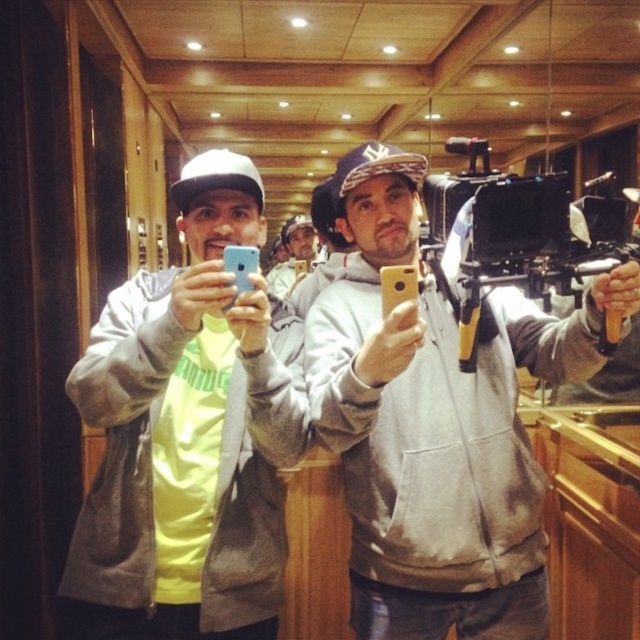
Question: Among these points, which one is farthest from the camera?

Choices:
 (A) (500, 380)
 (B) (579, 300)
 (C) (211, 161)

Answer: (A)

Question: Which point appears closest to the camera in this image?

Choices:
 (A) (272, 272)
 (B) (492, 417)
 (C) (68, 397)

Answer: (B)

Question: Estimate the real-world distances between objects in this image. Which object is closer to the matte yellow shirt at center?

Choices:
 (A) matte yellow phone at center
 (B) black plastic video camera at center right
 (C) gray matte hoodie at center

Answer: (C)

Question: Is gray matte hoodie at center thinner than matte yellow shirt at center?

Choices:
 (A) no
 (B) yes

Answer: (A)

Question: Does gray matte hoodie at center appear under matte yellow phone at center?

Choices:
 (A) no
 (B) yes

Answer: (A)

Question: Can you confirm if black plastic video camera at center right is bigger than matte yellow shirt at center?

Choices:
 (A) yes
 (B) no

Answer: (B)